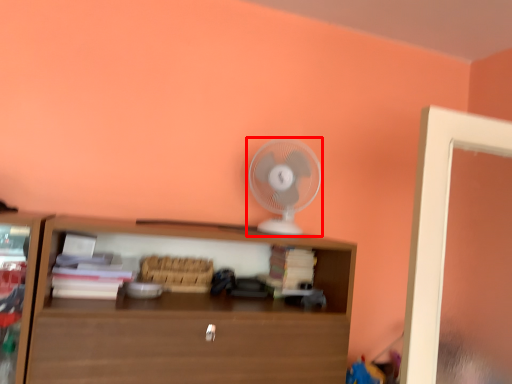
Question: In this image, where is mechanical fan (annotated by the red box) located relative to shelf?

Choices:
 (A) left
 (B) right

Answer: (B)